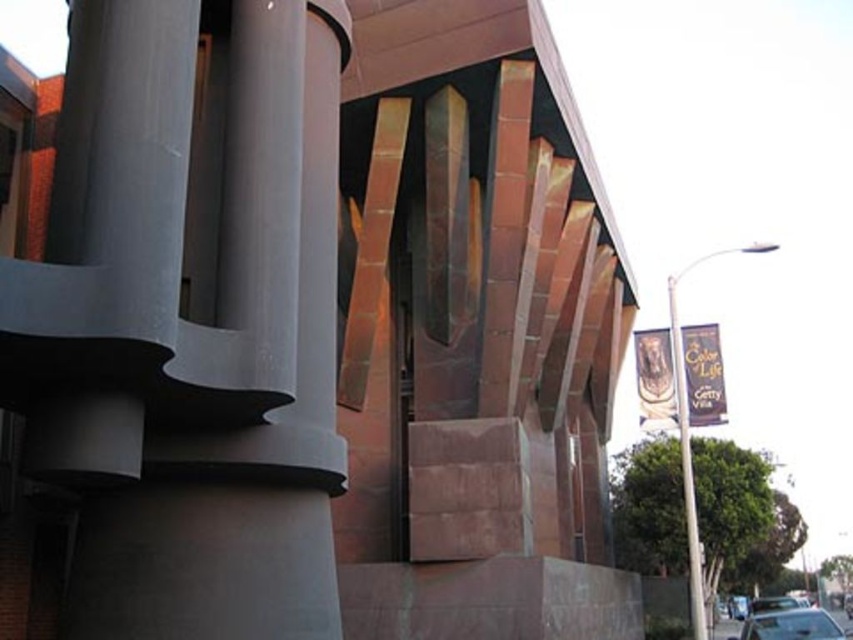
Consider the image. You are standing at the base of the Getty Villa structure and want to reach a specific point marked at coordinates point [700,563]. If your maximum reach is 14 meters, can you touch that point without moving closer?

The point [700,563] is 14.49 meters away from the viewer. Since your maximum reach is 14 meters, you cannot touch it without moving closer.

You are an architect designing a new sculpture to be placed between the silver metallic pole at right and the metallic silver car at lower right. Considering their widths, which object should the sculpture be closer to to maintain visual balance?

The sculpture should be closer to the metallic silver car at lower right because the silver metallic pole at right is wider, so placing the sculpture near the narrower car would balance the visual weight.

You are standing on the balcony of the Getty Villa and see the silver metallic pole at right and the white metallic pole at right. Which pole is closer to you?

The silver metallic pole at right is closer to you because it is further to the viewer than the white metallic pole at right.